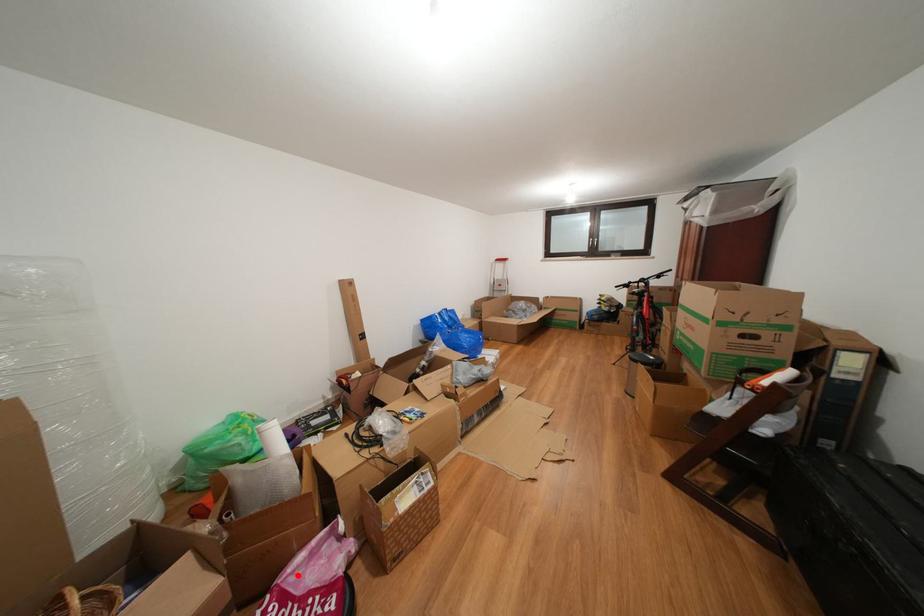
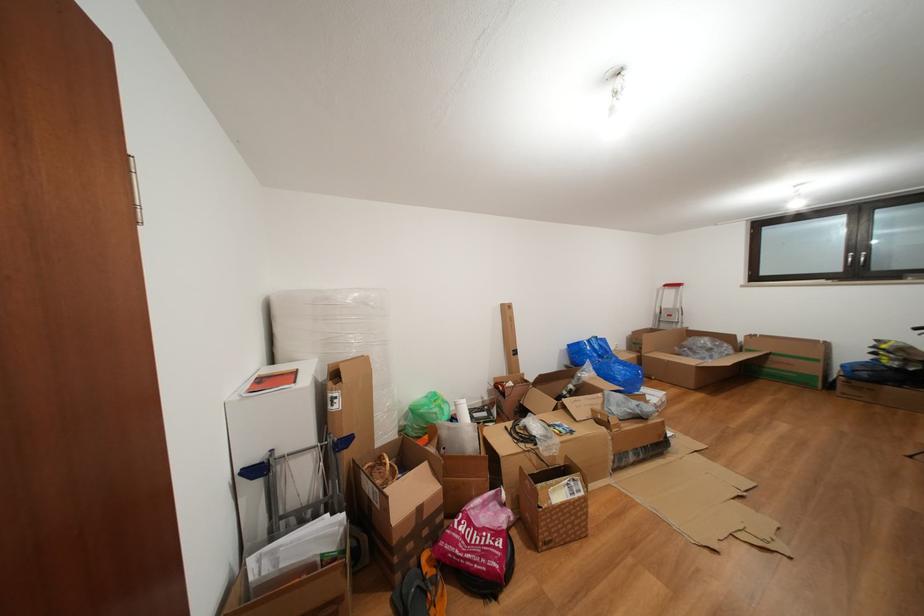
Locate, in the second image, the point that corresponds to the highlighted location in the first image.

(480, 511)